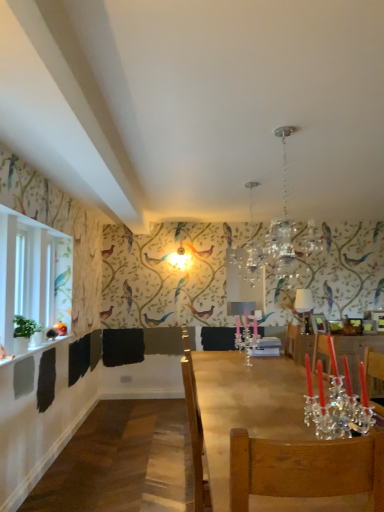
The height and width of the screenshot is (512, 384). Describe the element at coordinates (303, 301) in the screenshot. I see `white glossy lampshade at upper center` at that location.

Identify the location of white glossy lampshade at upper center. (303, 301).

Which is nearer, (217, 395) or (256, 323)?

The point (217, 395) is closer to the camera.

Considering the relative sizes of wooden table at center and clear crystal candle holder at center in the image provided, is wooden table at center taller than clear crystal candle holder at center?

No.

Considering the sizes of objects wooden table at center and clear crystal candle holder at center in the image provided, who is wider, wooden table at center or clear crystal candle holder at center?

wooden table at center is wider.

Does wooden table at center have a smaller size compared to clear crystal candle holder at center?

No, wooden table at center is not smaller than clear crystal candle holder at center.

Between clear crystal candle holder at center and wooden table at center, which one has smaller size?

Smaller between the two is clear crystal candle holder at center.

From the image's perspective, is clear crystal candle holder at center beneath wooden table at center?

Yes, from the image's perspective, clear crystal candle holder at center is below wooden table at center.

Considering the sizes of clear crystal candle holder at center and wooden table at center in the image, is clear crystal candle holder at center taller or shorter than wooden table at center?

Clearly, clear crystal candle holder at center is taller compared to wooden table at center.

Find the location of a particular element. candle holder located below the wooden table at center (from the image's perspective) is located at coordinates (246, 337).

How many degrees apart are the facing directions of clear crystal candle holder at center and crystal glass chandelier at upper center?

The angle between the facing direction of clear crystal candle holder at center and the facing direction of crystal glass chandelier at upper center is 4.46 degrees.

Considering the points (239, 322) and (251, 261), which point is in front, point (239, 322) or point (251, 261)?

The point (251, 261) is more forward.

Considering the sizes of objects clear crystal candle holder at center and crystal glass chandelier at upper center in the image provided, who is thinner, clear crystal candle holder at center or crystal glass chandelier at upper center?

Thinner between the two is clear crystal candle holder at center.

From a real-world perspective, which is physically above, clear crystal candle holder at center or crystal glass chandelier at upper center?

In real-world perspective, crystal glass chandelier at upper center is above.

Is white glossy lampshade at upper center far from crystal glass chandelier at upper center?

No.

Does white glossy lampshade at upper center lie in front of crystal glass chandelier at upper center?

No, white glossy lampshade at upper center is further to the viewer.

Is white glossy lampshade at upper center situated inside crystal glass chandelier at upper center or outside?

white glossy lampshade at upper center is not enclosed by crystal glass chandelier at upper center.

Is white glossy lampshade at upper center not near clear crystal candle holder at center?

No, there isn't a large distance between white glossy lampshade at upper center and clear crystal candle holder at center.

Considering the relative sizes of white glossy lampshade at upper center and clear crystal candle holder at center in the image provided, is white glossy lampshade at upper center shorter than clear crystal candle holder at center?

Incorrect, the height of white glossy lampshade at upper center does not fall short of that of clear crystal candle holder at center.

Between white glossy lampshade at upper center and clear crystal candle holder at center, which one appears on the left side from the viewer's perspective?

clear crystal candle holder at center.

What are the coordinates of `lamp above the clear crystal candle holder at center (from a real-world perspective)` in the screenshot? It's located at (303, 301).

Consider the image. From a real-world perspective, is crystal glass chandelier at upper center physically above white glossy lampshade at upper center?

Yes, from a real-world perspective, crystal glass chandelier at upper center is on top of white glossy lampshade at upper center.

Considering the positions of points (264, 251) and (309, 311), is point (264, 251) closer to camera compared to point (309, 311)?

Yes.

Based on the photo, could you tell me if crystal glass chandelier at upper center is turned towards white glossy lampshade at upper center?

No, crystal glass chandelier at upper center does not turn towards white glossy lampshade at upper center.

Which of these two, crystal glass chandelier at upper center or white glossy lampshade at upper center, is smaller?

white glossy lampshade at upper center.

Could you tell me if crystal glass chandelier at upper center is turned towards clear crystal candle holder at center?

No, crystal glass chandelier at upper center does not turn towards clear crystal candle holder at center.

The height and width of the screenshot is (512, 384). Identify the location of candle holder that appears below the crystal glass chandelier at upper center (from the image's perspective). (246, 337).

Is crystal glass chandelier at upper center positioned in front of clear crystal candle holder at center?

Yes, it is.

Considering the sizes of objects crystal glass chandelier at upper center and clear crystal candle holder at center in the image provided, who is shorter, crystal glass chandelier at upper center or clear crystal candle holder at center?

Standing shorter between the two is clear crystal candle holder at center.

Identify the location of table in front of the clear crystal candle holder at center. Image resolution: width=384 pixels, height=512 pixels. (277, 441).

Locate an element on the screen. The image size is (384, 512). candle holder below the wooden table at center (from the image's perspective) is located at coordinates (246, 337).

Based on their spatial positions, is clear crystal candle holder at center or crystal glass chandelier at upper center closer to wooden table at center?

clear crystal candle holder at center is closer to wooden table at center.

Looking at the image, which one is located closer to crystal glass chandelier at upper center, clear crystal candle holder at center or white glossy lampshade at upper center?

white glossy lampshade at upper center is positioned closer to the anchor crystal glass chandelier at upper center.

From the image, which object appears to be nearer to clear crystal candle holder at center, white glossy lampshade at upper center or crystal glass chandelier at upper center?

Among the two, white glossy lampshade at upper center is located nearer to clear crystal candle holder at center.

Which object lies further to the anchor point white glossy lampshade at upper center, wooden table at center or clear crystal candle holder at center?

Among the two, wooden table at center is located further to white glossy lampshade at upper center.

Based on their spatial positions, is clear crystal candle holder at center or wooden table at center further from crystal glass chandelier at upper center?

The object further to crystal glass chandelier at upper center is wooden table at center.

From the image, which object appears to be farther from wooden table at center, crystal glass chandelier at upper center or clear crystal candle holder at center?

Based on the image, crystal glass chandelier at upper center appears to be further to wooden table at center.

Considering their positions, is wooden table at center positioned closer to clear crystal candle holder at center than crystal glass chandelier at upper center?

crystal glass chandelier at upper center.

Based on their spatial positions, is crystal glass chandelier at upper center or clear crystal candle holder at center closer to white glossy lampshade at upper center?

crystal glass chandelier at upper center lies closer to white glossy lampshade at upper center than the other object.

In order to click on light fixture between wooden table at center and white glossy lampshade at upper center from front to back in this screenshot , I will do `click(282, 229)`.

I want to click on candle holder located between wooden table at center and white glossy lampshade at upper center in the depth direction, so point(246,337).

Where is `light fixture between wooden table at center and clear crystal candle holder at center along the z-axis`? light fixture between wooden table at center and clear crystal candle holder at center along the z-axis is located at coordinates tap(282, 229).

At what (x,y) coordinates should I click in order to perform the action: click on candle holder between crystal glass chandelier at upper center and white glossy lampshade at upper center from front to back. Please return your answer as a coordinate pair (x, y). This screenshot has width=384, height=512. Looking at the image, I should click on (246, 337).